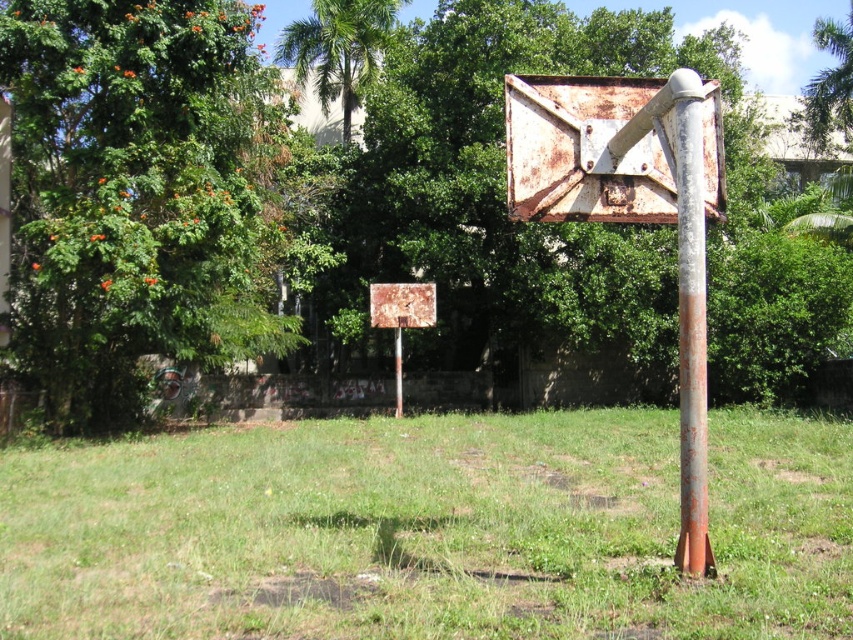
Question: Which of the following is the farthest from the observer?

Choices:
 (A) (659, 93)
 (B) (685, 424)

Answer: (A)

Question: Does green leafy tree at center have a larger size compared to green leafy tree at upper center?

Choices:
 (A) no
 (B) yes

Answer: (B)

Question: Can you confirm if green leafy tree at center is positioned above green grassy at center?

Choices:
 (A) yes
 (B) no

Answer: (A)

Question: Estimate the real-world distances between objects in this image. Which object is farther from the green leafy tree at center?

Choices:
 (A) rusty metal sign at upper right
 (B) green leafy tree at upper center
 (C) rusty metal pole at center

Answer: (A)

Question: Which is farther from the green grassy at center?

Choices:
 (A) green leafy tree at left
 (B) rusty metal sign at upper right
 (C) rusty metal basketball hoop at center

Answer: (C)

Question: Is green leafy tree at left further to camera compared to rusty metal sign at upper right?

Choices:
 (A) no
 (B) yes

Answer: (B)